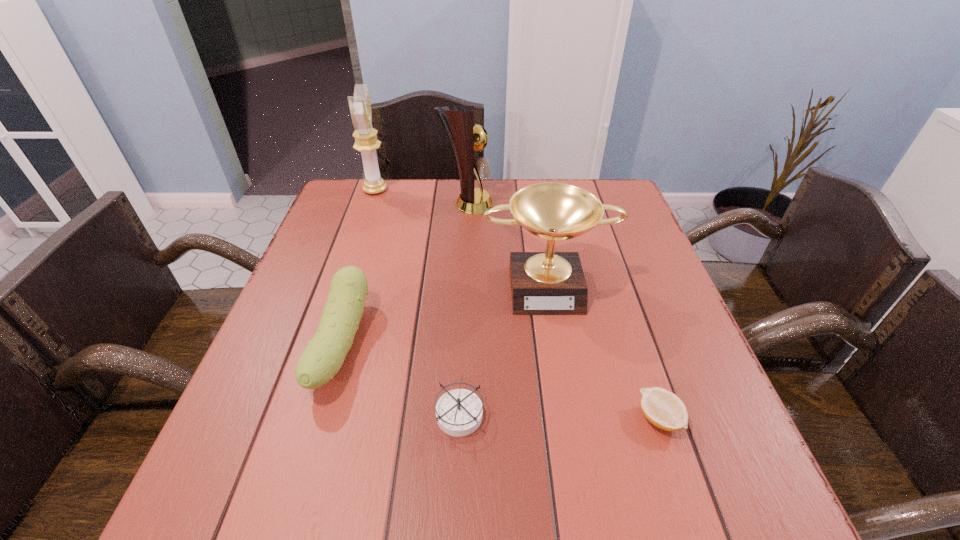
You are a GUI agent. You are given a task and a screenshot of the screen. Output one action in this format:
    pyautogui.click(x=<x>, y=<y>)
    Task: Click on the leftmost award
    
    Given the screenshot: What is the action you would take?
    pyautogui.click(x=366, y=142)

I want to click on the nearest award, so click(x=542, y=283).

Identify the location of the third tallest object. coord(542,283).

Identify the location of cucumber. This screenshot has width=960, height=540. (321, 360).

Identify the location of compass. This screenshot has height=540, width=960. (459, 412).

Locate an element on the screen. Image resolution: width=960 pixels, height=540 pixels. lemon is located at coordinates (665, 410).

Image resolution: width=960 pixels, height=540 pixels. What are the coordinates of `vacant space located 0.280m on the front-facing side of the leftmost award` in the screenshot? It's located at (478, 190).

Identify the location of vacant space located 0.210m on the front-facing side of the nearest award. (565, 398).

Identify the location of free space located 0.060m on the back of the third shortest object. (362, 278).

Where is `free space located 0.110m on the back of the compass`? free space located 0.110m on the back of the compass is located at coordinates (462, 345).